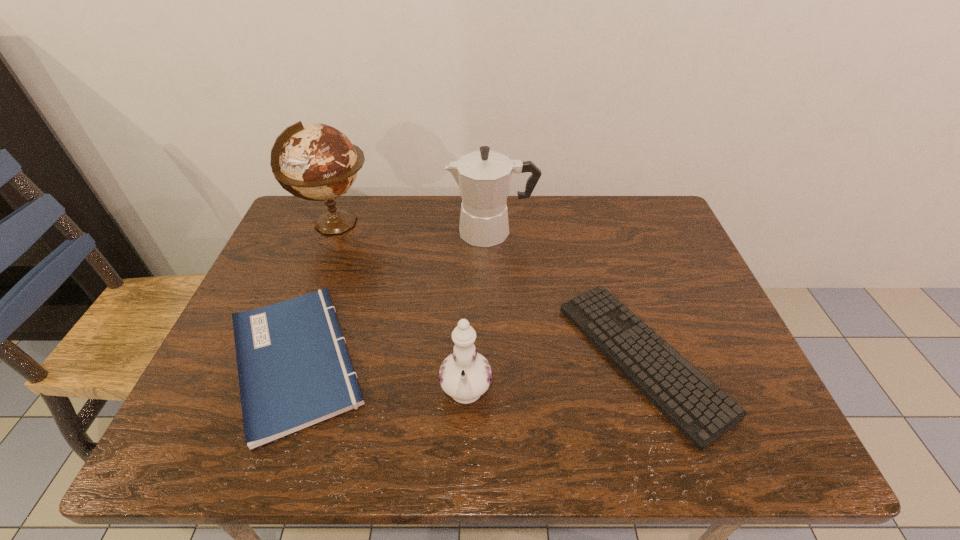
You are a GUI agent. You are given a task and a screenshot of the screen. Output one action in this format:
    pyautogui.click(x=<x>, y=<y>)
    Task: Click on the vacant space at the far right corner of the desktop
    The width and height of the screenshot is (960, 540).
    Given the screenshot: What is the action you would take?
    pyautogui.click(x=632, y=231)

You are a GUI agent. You are given a task and a screenshot of the screen. Output one action in this format:
    pyautogui.click(x=<x>, y=<y>)
    Task: Click on the vacant point located between the rightmost object and the globe
    This screenshot has height=540, width=960.
    Given the screenshot: What is the action you would take?
    pyautogui.click(x=490, y=291)

This screenshot has height=540, width=960. Identify the location of vacant space in between the paperback book and the third shortest object. (381, 378).

This screenshot has width=960, height=540. In order to click on vacant point located between the fourth tallest object and the third shortest object in this screenshot , I will do `click(381, 378)`.

Where is `free space between the paperback book and the third tallest object`? free space between the paperback book and the third tallest object is located at coordinates (381, 378).

This screenshot has height=540, width=960. Identify the location of free space between the third shortest object and the computer keyboard. (554, 377).

Where is `free space between the chinaware and the coffeepot`? free space between the chinaware and the coffeepot is located at coordinates (479, 313).

Identify which object is the second nearest to the fourth tallest object. Please provide its 2D coordinates. Your answer should be formatted as a tuple, i.e. [(x, y)], where the tuple contains the x and y coordinates of a point satisfying the conditions above.

[(318, 162)]

Locate which object ranks fourth in proximity to the second shortest object. Please provide its 2D coordinates. Your answer should be formatted as a tuple, i.e. [(x, y)], where the tuple contains the x and y coordinates of a point satisfying the conditions above.

[(702, 412)]

The height and width of the screenshot is (540, 960). I want to click on free location that satisfies the following two spatial constraints: 1. at the spout of the fourth shortest object; 2. on the right side of the rightmost object, so click(x=496, y=358).